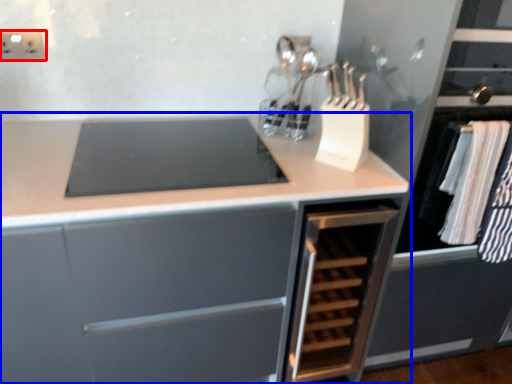
Question: Which object is closer to the camera taking this photo, electric outlet (highlighted by a red box) or cabinetry (highlighted by a blue box)?

Choices:
 (A) electric outlet
 (B) cabinetry

Answer: (B)